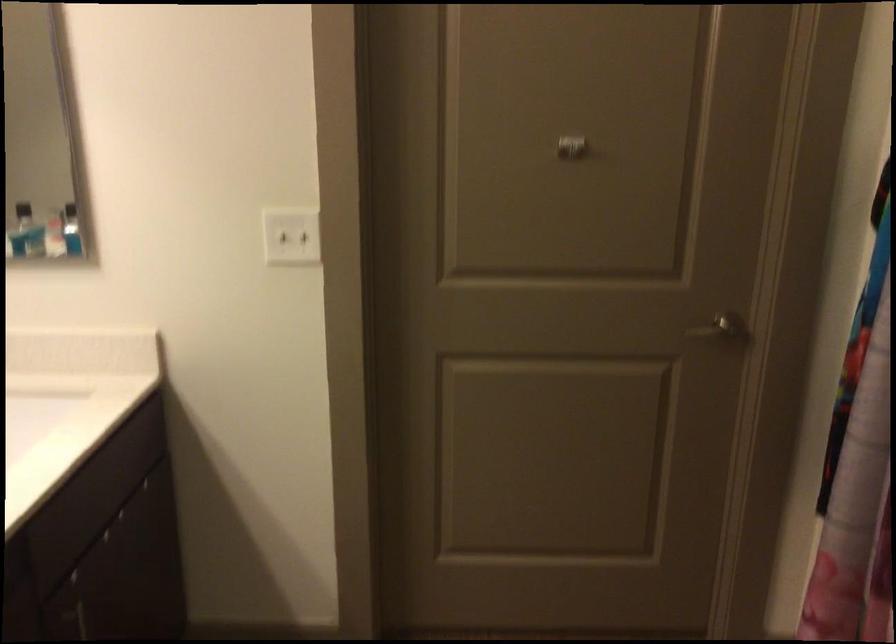
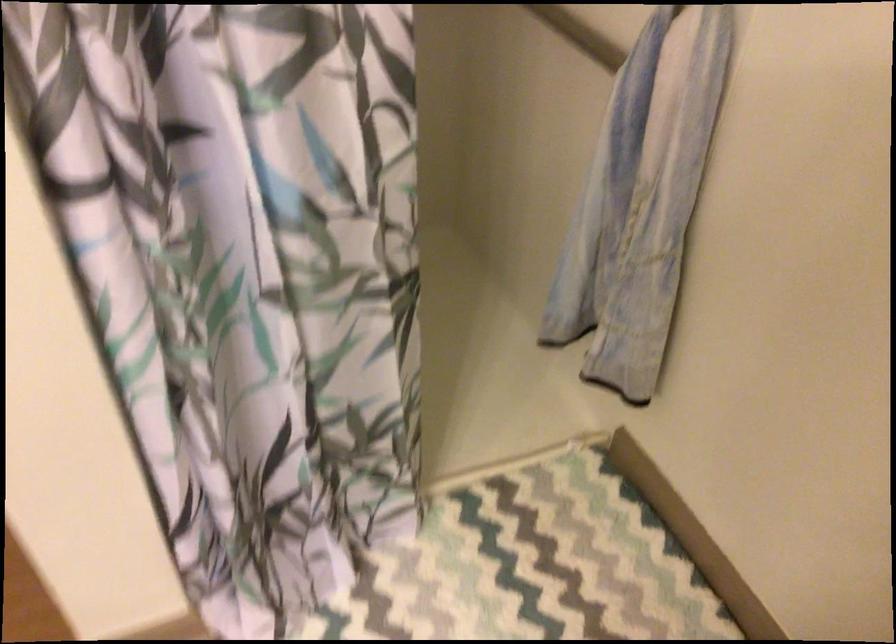
Based on the continuous images, in which direction is the camera rotating?

The rotation direction of the camera is right-down.